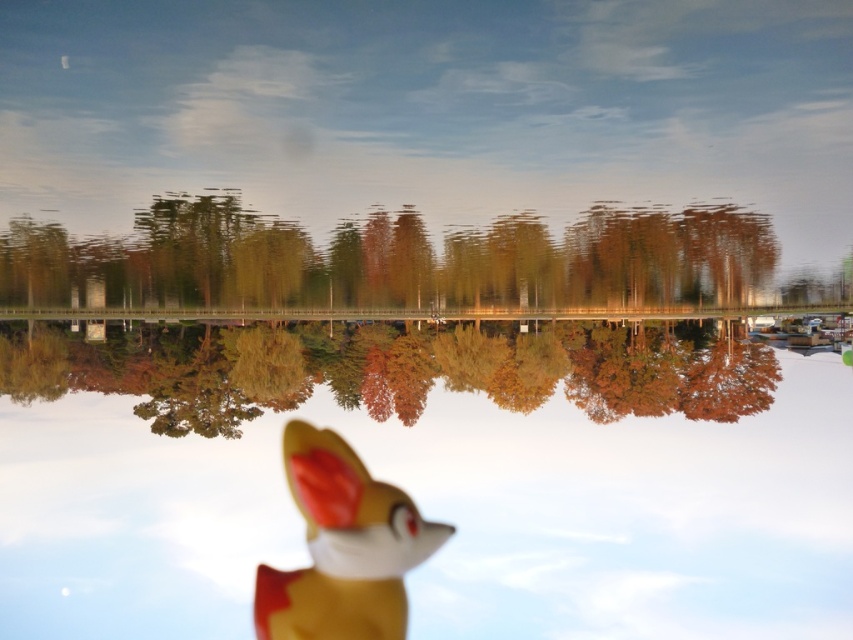
You are standing in the scene and want to pick up the closest object to you. Which object should you choose between the transparent glass water at center and the soft yellow plush toy at center?

The transparent glass water at center is closer to the viewer than the soft yellow plush toy at center, so you should pick up the transparent glass water at center.

What is the height relationship between the autumn leaves at upper center and the soft yellow plush toy at center?

The autumn leaves at upper center are shorter than the soft yellow plush toy at center.